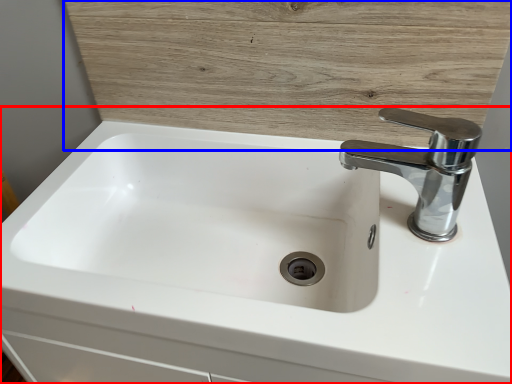
Question: Which of the following is the farthest to the observer, sink (highlighted by a red box) or wood (highlighted by a blue box)?

Choices:
 (A) sink
 (B) wood

Answer: (B)